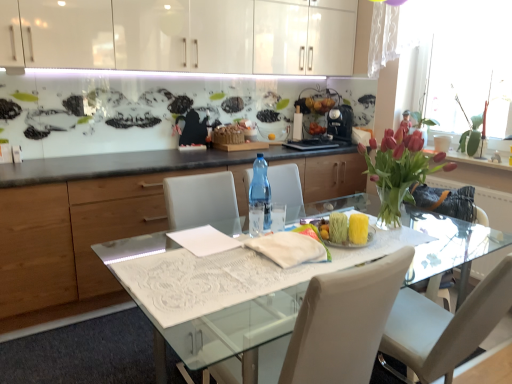
Question: Should I look upward or downward to see transparent glass cup at center?

Choices:
 (A) down
 (B) up

Answer: (A)

Question: Considering the relative sizes of transparent plastic bottle at center and translucent glass vase at upper right in the image provided, is transparent plastic bottle at center thinner than translucent glass vase at upper right?

Choices:
 (A) no
 (B) yes

Answer: (B)

Question: Is transparent plastic bottle at center turned away from translucent glass vase at upper right?

Choices:
 (A) no
 (B) yes

Answer: (A)

Question: Is transparent plastic bottle at center bigger than translucent glass vase at upper right?

Choices:
 (A) yes
 (B) no

Answer: (B)

Question: Is transparent plastic bottle at center completely or partially outside of translucent glass vase at upper right?

Choices:
 (A) yes
 (B) no

Answer: (A)

Question: Does transparent plastic bottle at center have a greater height compared to translucent glass vase at upper right?

Choices:
 (A) no
 (B) yes

Answer: (A)

Question: Is transparent plastic bottle at center positioned far away from translucent glass vase at upper right?

Choices:
 (A) yes
 (B) no

Answer: (A)

Question: Could you tell me if pink glass vase at right is turned towards white fabric at center?

Choices:
 (A) yes
 (B) no

Answer: (A)

Question: Is pink glass vase at right looking in the opposite direction of white fabric at center?

Choices:
 (A) no
 (B) yes

Answer: (A)

Question: Can you confirm if pink glass vase at right is bigger than white fabric at center?

Choices:
 (A) no
 (B) yes

Answer: (B)

Question: Considering the relative sizes of pink glass vase at right and white fabric at center in the image provided, is pink glass vase at right smaller than white fabric at center?

Choices:
 (A) yes
 (B) no

Answer: (B)

Question: Is pink glass vase at right to the right of white fabric at center from the viewer's perspective?

Choices:
 (A) yes
 (B) no

Answer: (A)

Question: Would you say pink glass vase at right is a long distance from white fabric at center?

Choices:
 (A) yes
 (B) no

Answer: (B)

Question: Is translucent glass vase at upper right taller than white fabric at center?

Choices:
 (A) yes
 (B) no

Answer: (A)